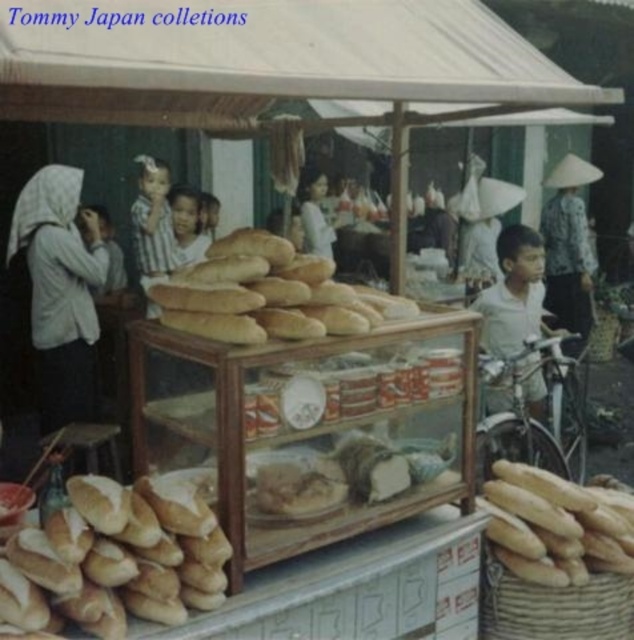
Question: Which object is positioned farthest from the white cotton shirt at center?

Choices:
 (A) golden brown crusty baguette at lower right
 (B) white cloth headscarf at left

Answer: (A)

Question: Considering the relative positions of golden brown crusty baguette at lower left and white cotton shirt at center in the image provided, where is golden brown crusty baguette at lower left located with respect to white cotton shirt at center?

Choices:
 (A) above
 (B) below

Answer: (B)

Question: Which object is the closest to the white cotton shirt at center?

Choices:
 (A) golden brown crusty baguette at lower right
 (B) golden brown crusty baguettes at center
 (C) white cloth headscarf at left

Answer: (C)

Question: Can you confirm if golden brown crusty baguette at lower right is positioned below white cotton shirt at center?

Choices:
 (A) no
 (B) yes

Answer: (B)

Question: Can you confirm if golden brown crusty baguette at lower right is positioned to the left of white cotton shirt at center?

Choices:
 (A) yes
 (B) no

Answer: (B)

Question: Which object is positioned farthest from the white cloth headscarf at left?

Choices:
 (A) golden brown crusty baguette at lower right
 (B) white cotton shirt at center
 (C) golden brown crusty baguettes at center

Answer: (A)